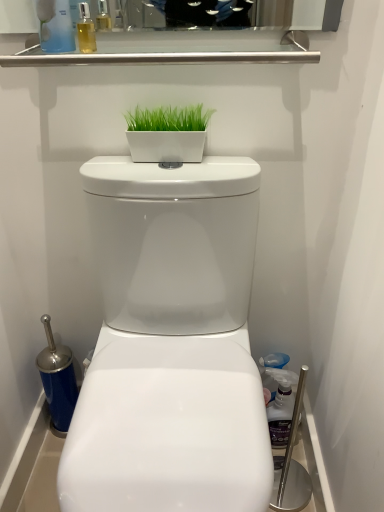
Question: Can you confirm if translucent plastic bottle at upper left, which appears as the first cleaning product when viewed from the top, is bigger than white glossy toilet at center?

Choices:
 (A) yes
 (B) no

Answer: (B)

Question: Considering the relative positions of translucent plastic bottle at upper left, which is counted as the 2th cleaning product, starting from the back, and white glossy toilet at center in the image provided, is translucent plastic bottle at upper left, which is counted as the 2th cleaning product, starting from the back, to the right of white glossy toilet at center from the viewer's perspective?

Choices:
 (A) no
 (B) yes

Answer: (A)

Question: Is translucent plastic bottle at upper left, which appears as the first cleaning product when viewed from the top, located outside white glossy toilet at center?

Choices:
 (A) yes
 (B) no

Answer: (A)

Question: Is translucent plastic bottle at upper left, the 1th cleaning product positioned from the left, taller than white glossy toilet at center?

Choices:
 (A) no
 (B) yes

Answer: (A)

Question: Is translucent plastic bottle at upper left, which appears as the first cleaning product when viewed from the top, smaller than white glossy toilet at center?

Choices:
 (A) yes
 (B) no

Answer: (A)

Question: Considering the relative positions of white glossy toilet at center and green matte planter at center in the image provided, is white glossy toilet at center in front of green matte planter at center?

Choices:
 (A) no
 (B) yes

Answer: (B)

Question: From the image's perspective, is white glossy toilet at center above green matte planter at center?

Choices:
 (A) no
 (B) yes

Answer: (A)

Question: From the image's perspective, is white glossy toilet at center located beneath green matte planter at center?

Choices:
 (A) no
 (B) yes

Answer: (B)

Question: Can you confirm if white glossy toilet at center is positioned to the left of green matte planter at center?

Choices:
 (A) no
 (B) yes

Answer: (A)

Question: Is green matte planter at center located within white glossy toilet at center?

Choices:
 (A) yes
 (B) no

Answer: (B)

Question: Are white glossy toilet at center and green matte planter at center located far from each other?

Choices:
 (A) yes
 (B) no

Answer: (B)

Question: Considering the relative sizes of translucent plastic bottle at upper left, which is counted as the 2th cleaning product, starting from the back, and green matte planter at center in the image provided, is translucent plastic bottle at upper left, which is counted as the 2th cleaning product, starting from the back, wider than green matte planter at center?

Choices:
 (A) yes
 (B) no

Answer: (A)